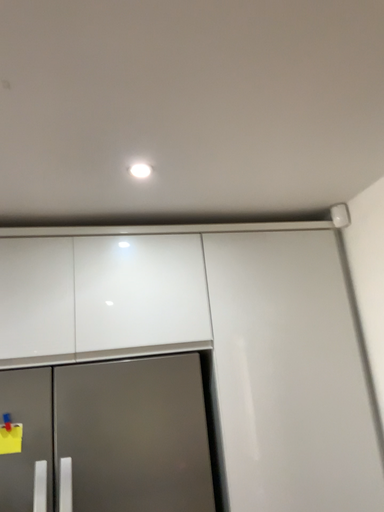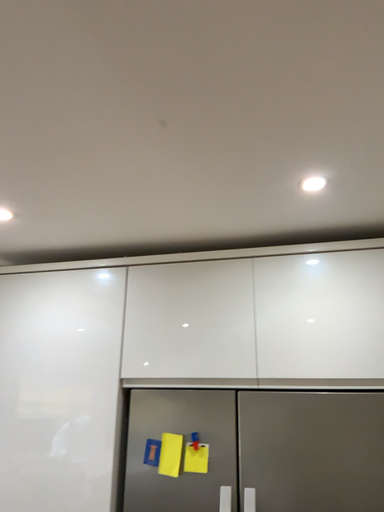
Question: Which way did the camera rotate in the video?

Choices:
 (A) rotated right
 (B) rotated left

Answer: (B)